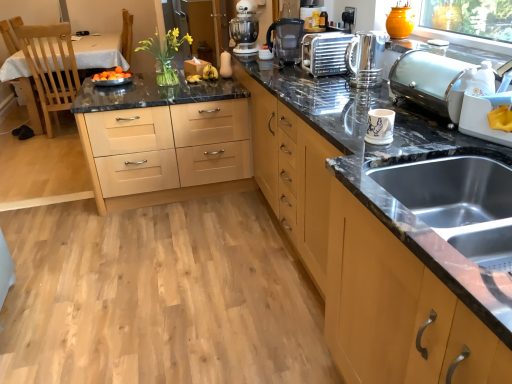
Find the location of `vacant area that is situated to the right of white ceramic mug at upper right, the third appliance in the top-to-bottom sequence`. vacant area that is situated to the right of white ceramic mug at upper right, the third appliance in the top-to-bottom sequence is located at coordinates (421, 135).